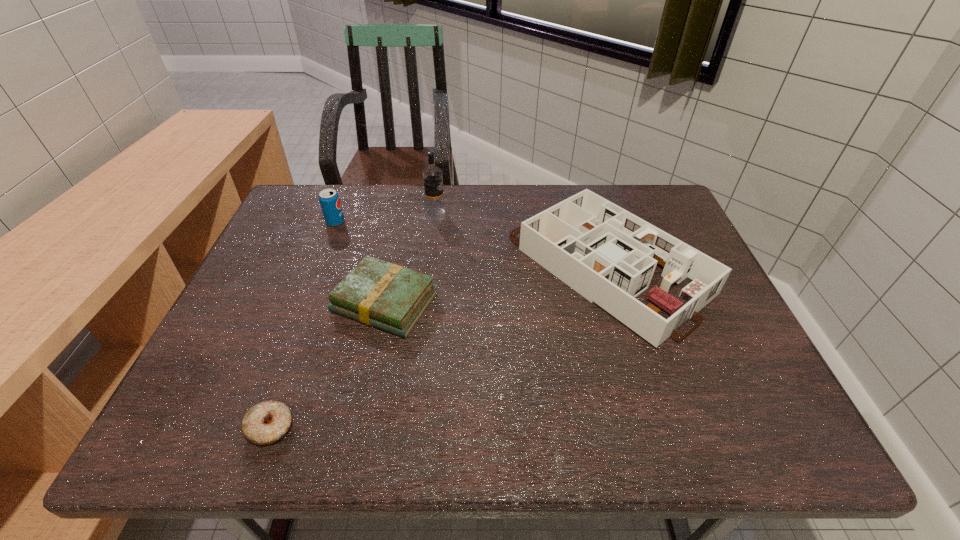
Where is `vodka`? The width and height of the screenshot is (960, 540). vodka is located at coordinates (432, 175).

The width and height of the screenshot is (960, 540). Find the location of `soda can`. soda can is located at coordinates (329, 200).

This screenshot has width=960, height=540. I want to click on the rightmost object, so click(x=608, y=255).

Identify the location of the second shortest object. This screenshot has width=960, height=540. (377, 293).

The image size is (960, 540). What are the coordinates of `the shortest object` in the screenshot? It's located at (265, 423).

What are the coordinates of `doughnut` in the screenshot? It's located at (265, 423).

Find the location of `vacant space located 0.140m on the label of the tallest object`. vacant space located 0.140m on the label of the tallest object is located at coordinates (492, 213).

This screenshot has width=960, height=540. What are the coordinates of `vacant space situated 0.090m on the back of the soda can` in the screenshot? It's located at (345, 199).

The image size is (960, 540). Identify the location of free spot located 0.310m on the left of the dollhouse. (394, 267).

Find the location of a particular element. The image size is (960, 540). free spot located 0.060m on the left of the fourth tallest object is located at coordinates (308, 302).